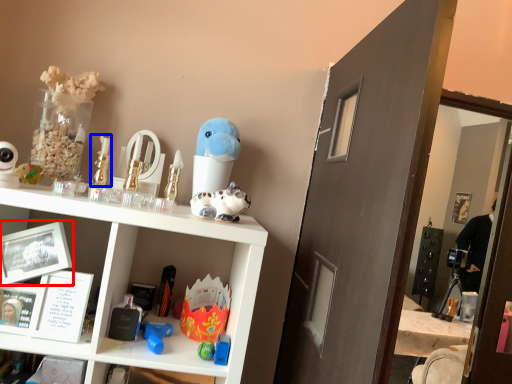
Question: Among these objects, which one is farthest to the camera, picture frame (highlighted by a red box) or toy (highlighted by a blue box)?

Choices:
 (A) picture frame
 (B) toy

Answer: (B)